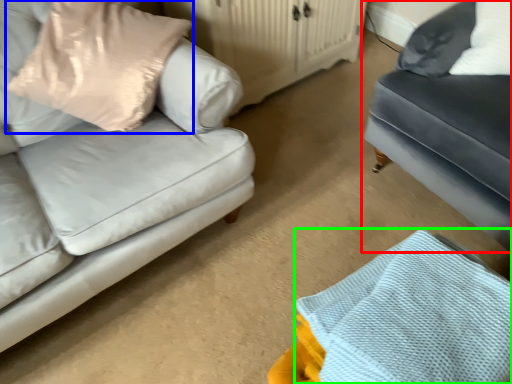
Question: Based on their relative distances, which object is farther from studio couch (highlighted by a red box)? Choose from pillow (highlighted by a blue box) and material (highlighted by a green box).

Choices:
 (A) pillow
 (B) material

Answer: (A)